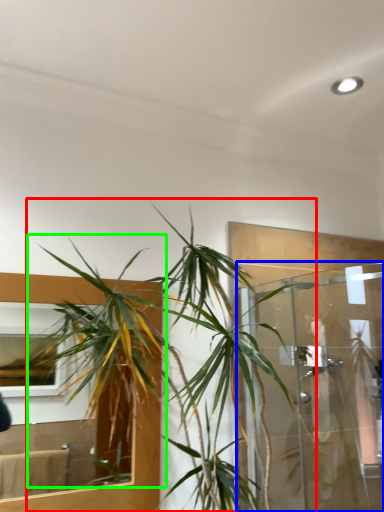
Question: Which object is positioned farthest from houseplant (highlighted by a red box)? Select from glass door (highlighted by a blue box) and vegetation (highlighted by a green box).

Choices:
 (A) glass door
 (B) vegetation

Answer: (A)